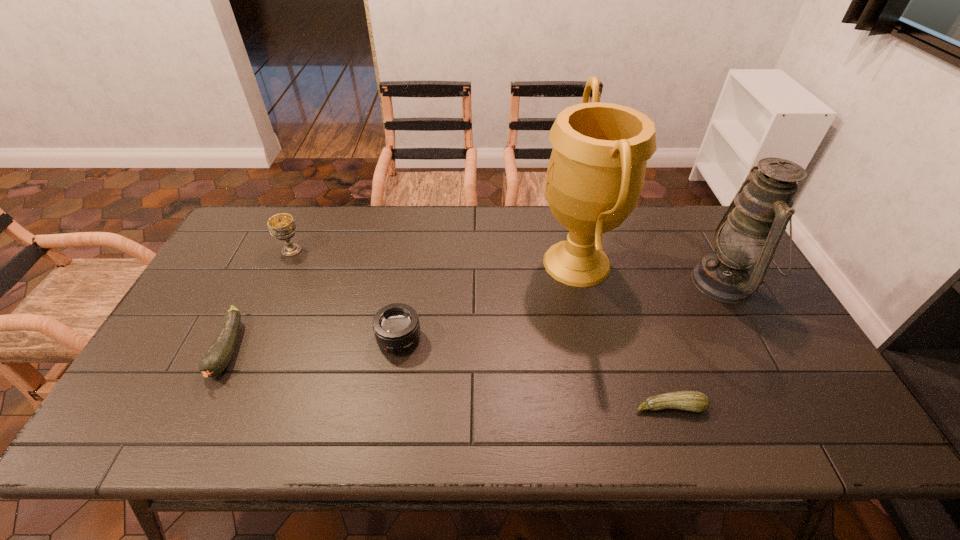
I want to click on vacant point located on the engravings side of the trophy, so click(464, 263).

Locate an element on the screen. vacant region located 0.190m on the engravings side of the trophy is located at coordinates (473, 263).

At what (x,y) coordinates should I click in order to perform the action: click on free spot located on the engravings side of the trophy. Please return your answer as a coordinate pair (x, y). The height and width of the screenshot is (540, 960). Looking at the image, I should click on (480, 263).

Identify the location of vacant space located 0.120m on the back of the oil lamp. The width and height of the screenshot is (960, 540). (696, 230).

At what (x,y) coordinates should I click in order to perform the action: click on vacant space located 0.060m on the right of the fourth shortest object. Please return your answer as a coordinate pair (x, y). The width and height of the screenshot is (960, 540). Looking at the image, I should click on (323, 250).

Image resolution: width=960 pixels, height=540 pixels. Find the location of `vacant area situated 0.140m on the side of the fourth object from right to left with brand markings and control switches`. vacant area situated 0.140m on the side of the fourth object from right to left with brand markings and control switches is located at coordinates (388, 408).

Locate an element on the screen. vacant space located 0.090m at the blossom end of the taller zucchini is located at coordinates (192, 424).

The height and width of the screenshot is (540, 960). Find the location of `trophy present at the far edge`. trophy present at the far edge is located at coordinates (596, 172).

Identify the location of chalice located at the far edge. The height and width of the screenshot is (540, 960). (282, 226).

Locate an element on the screen. The width and height of the screenshot is (960, 540). object positioned at the near edge is located at coordinates (694, 401).